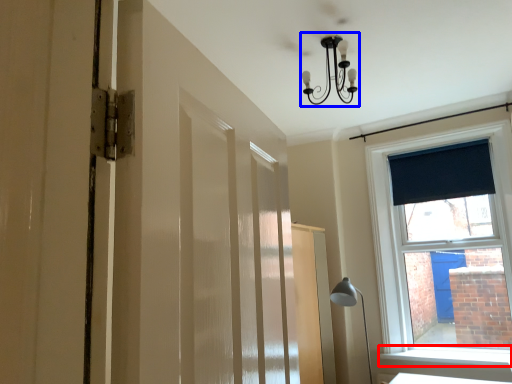
Question: Which object is closer to the camera taking this photo, window sill (highlighted by a red box) or light fixture (highlighted by a blue box)?

Choices:
 (A) window sill
 (B) light fixture

Answer: (B)